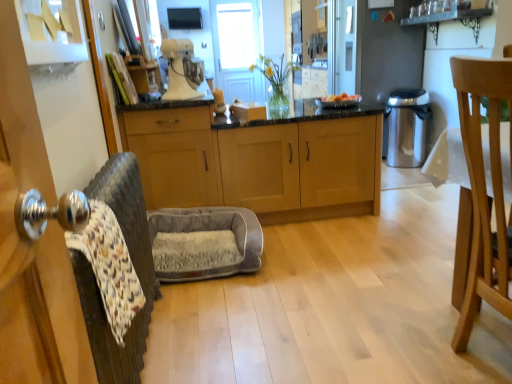
Question: Is stainless steel trash can at right completely or partially inside light brown wood cabinets at center, acting as the first cabinetry starting from the right?

Choices:
 (A) no
 (B) yes

Answer: (A)

Question: From the image's perspective, is light brown wood cabinets at center, positioned as the 2th cabinetry in left-to-right order, on top of stainless steel trash can at right?

Choices:
 (A) yes
 (B) no

Answer: (B)

Question: Can you confirm if light brown wood cabinets at center, acting as the first cabinetry starting from the right, is taller than stainless steel trash can at right?

Choices:
 (A) no
 (B) yes

Answer: (B)

Question: Is light brown wood cabinets at center, acting as the first cabinetry starting from the right, outside of stainless steel trash can at right?

Choices:
 (A) no
 (B) yes

Answer: (B)

Question: Does light brown wood cabinets at center, positioned as the 2th cabinetry in left-to-right order, touch stainless steel trash can at right?

Choices:
 (A) yes
 (B) no

Answer: (B)

Question: Does light brown wood cabinets at center, positioned as the 2th cabinetry in left-to-right order, have a greater width compared to stainless steel trash can at right?

Choices:
 (A) yes
 (B) no

Answer: (A)

Question: Can you confirm if white matte stand mixer at upper center is thinner than matte wood cabinets at center, marked as the second cabinetry in a right-to-left arrangement?

Choices:
 (A) no
 (B) yes

Answer: (B)

Question: Does white matte stand mixer at upper center have a greater height compared to matte wood cabinets at center, the first cabinetry when ordered from left to right?

Choices:
 (A) no
 (B) yes

Answer: (A)

Question: Is white matte stand mixer at upper center oriented towards matte wood cabinets at center, marked as the second cabinetry in a right-to-left arrangement?

Choices:
 (A) yes
 (B) no

Answer: (B)

Question: Is white matte stand mixer at upper center positioned far away from matte wood cabinets at center, the first cabinetry when ordered from left to right?

Choices:
 (A) no
 (B) yes

Answer: (A)

Question: Is white matte stand mixer at upper center in front of matte wood cabinets at center, marked as the second cabinetry in a right-to-left arrangement?

Choices:
 (A) no
 (B) yes

Answer: (B)

Question: Does white matte stand mixer at upper center have a larger size compared to matte wood cabinets at center, the first cabinetry when ordered from left to right?

Choices:
 (A) no
 (B) yes

Answer: (A)

Question: Would you say light brown wooden chair at right is part of light brown wood cabinets at center, acting as the first cabinetry starting from the right,'s contents?

Choices:
 (A) no
 (B) yes

Answer: (A)